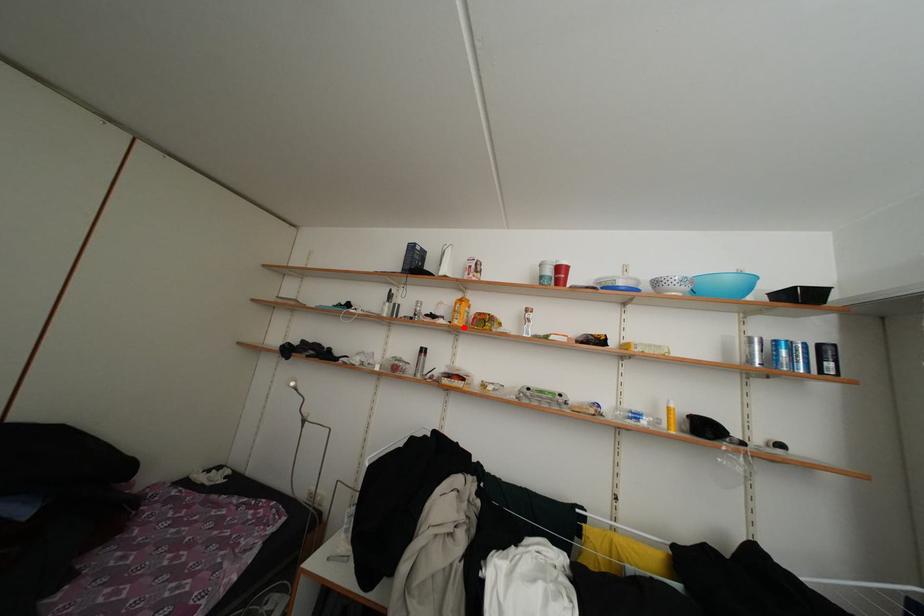
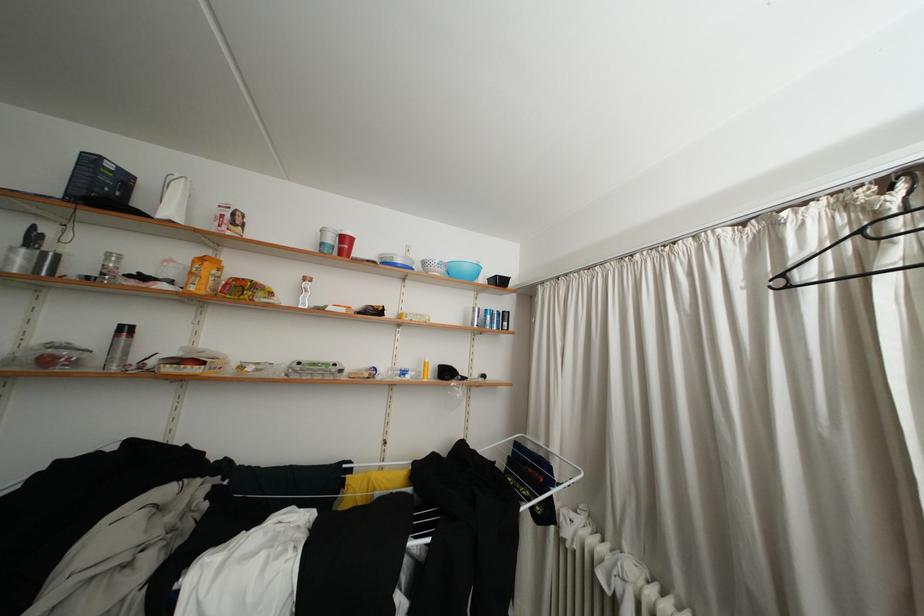
In the second image, find the point that corresponds to the highlighted location in the first image.

(200, 294)